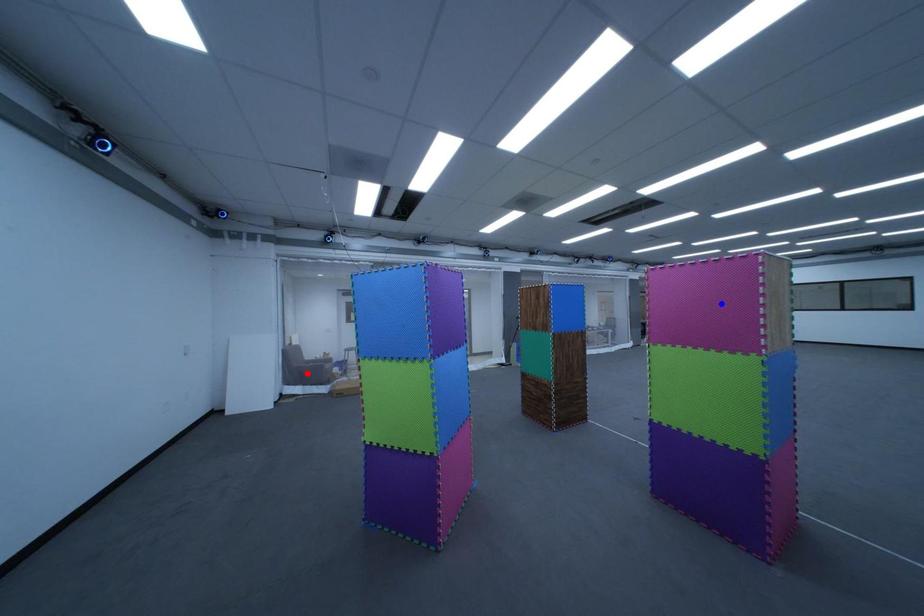
Question: Which of the two points in the image is closer to the camera?

Choices:
 (A) Blue point is closer.
 (B) Red point is closer.

Answer: (A)